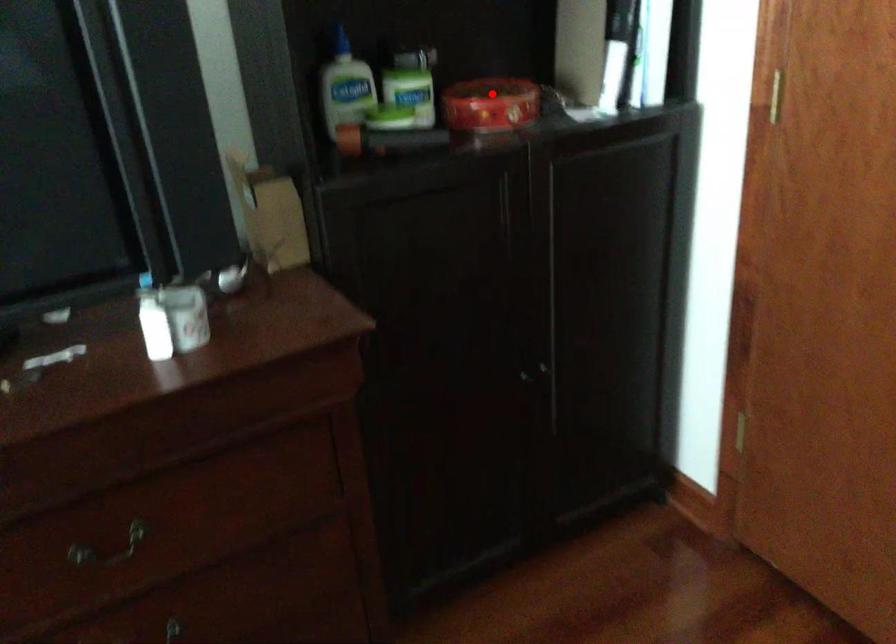
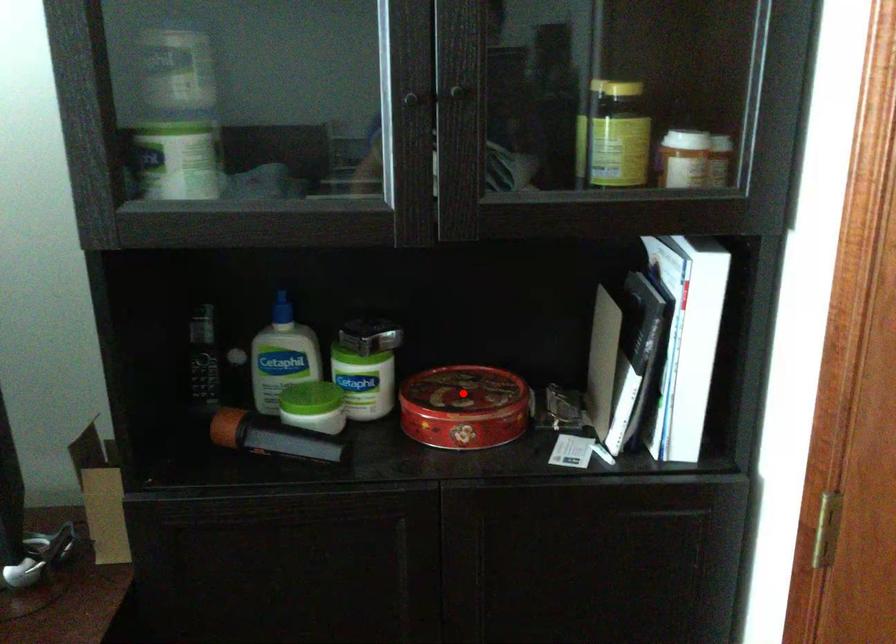
I am providing you with two images of the same scene from different viewpoints. A red point is marked on the first image and another point is marked on the second image. Does the point marked in image1 correspond to the same location as the one in image2?

Yes